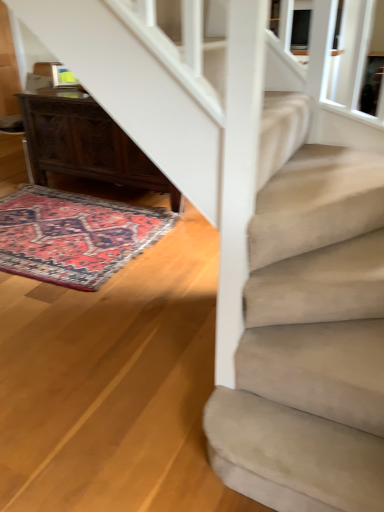
Question: Considering the relative sizes of carpeted rug at lower left and dark wood desk at lower left in the image provided, is carpeted rug at lower left bigger than dark wood desk at lower left?

Choices:
 (A) yes
 (B) no

Answer: (B)

Question: Is carpeted rug at lower left at the right side of dark wood desk at lower left?

Choices:
 (A) no
 (B) yes

Answer: (A)

Question: Is carpeted rug at lower left far from dark wood desk at lower left?

Choices:
 (A) yes
 (B) no

Answer: (B)

Question: Is carpeted rug at lower left outside of dark wood desk at lower left?

Choices:
 (A) no
 (B) yes

Answer: (B)

Question: Is carpeted rug at lower left smaller than dark wood desk at lower left?

Choices:
 (A) no
 (B) yes

Answer: (B)

Question: Can you confirm if carpeted rug at lower left is positioned to the left of dark wood desk at lower left?

Choices:
 (A) yes
 (B) no

Answer: (A)

Question: Considering the relative sizes of dark wood desk at lower left and carpeted rug at lower left in the image provided, is dark wood desk at lower left shorter than carpeted rug at lower left?

Choices:
 (A) no
 (B) yes

Answer: (A)

Question: Considering the relative sizes of dark wood desk at lower left and carpeted rug at lower left in the image provided, is dark wood desk at lower left taller than carpeted rug at lower left?

Choices:
 (A) yes
 (B) no

Answer: (A)

Question: From the image's perspective, would you say dark wood desk at lower left is shown under carpeted rug at lower left?

Choices:
 (A) no
 (B) yes

Answer: (A)

Question: Is dark wood desk at lower left positioned in front of carpeted rug at lower left?

Choices:
 (A) yes
 (B) no

Answer: (B)

Question: Is there a large distance between dark wood desk at lower left and carpeted rug at lower left?

Choices:
 (A) no
 (B) yes

Answer: (A)

Question: From a real-world perspective, is dark wood desk at lower left on top of carpeted rug at lower left?

Choices:
 (A) yes
 (B) no

Answer: (A)

Question: In the image, is dark wood desk at lower left positioned in front of or behind carpeted rug at lower left?

Choices:
 (A) behind
 (B) front

Answer: (A)